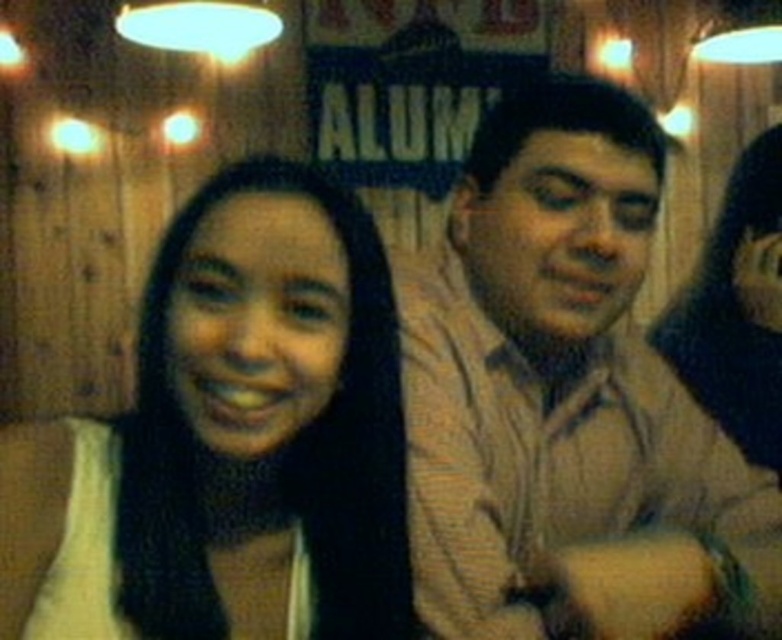
Question: Is light brown shirt at right bigger than dark brown hair at center?

Choices:
 (A) no
 (B) yes

Answer: (B)

Question: Which point appears farthest from the camera in this image?

Choices:
 (A) (336, 476)
 (B) (569, 456)

Answer: (B)

Question: In this image, where is light brown shirt at right located relative to dark brown hair at center?

Choices:
 (A) above
 (B) below

Answer: (A)

Question: Can you confirm if light brown shirt at right is positioned above dark brown hair at center?

Choices:
 (A) no
 (B) yes

Answer: (B)

Question: Among these objects, which one is nearest to the camera?

Choices:
 (A) light brown shirt at right
 (B) dark brown hair at center

Answer: (B)